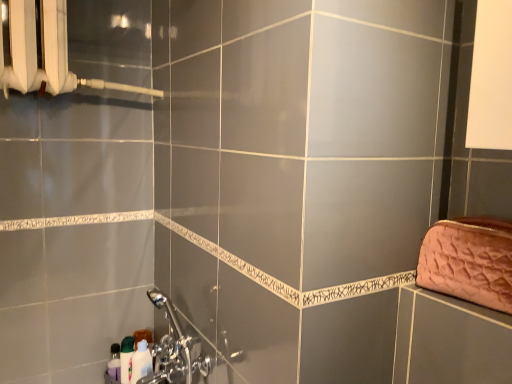
Question: Visually, is green glossy bottle at lower left, acting as the second toiletry starting from the right, positioned to the left or to the right of chrome metallic faucet at lower left?

Choices:
 (A) right
 (B) left

Answer: (B)

Question: From the image's perspective, is green glossy bottle at lower left, the second toiletry in the left-to-right sequence, located above or below chrome metallic faucet at lower left?

Choices:
 (A) below
 (B) above

Answer: (A)

Question: Based on their relative distances, which object is farther from the translucent plastic bottle at lower left, the 1th toiletry in the left-to-right sequence?

Choices:
 (A) green glossy bottle at lower left, acting as the second toiletry starting from the right
 (B) chrome metallic faucet at lower left
 (C) white glossy bottle at lower left, the third toiletry viewed from the left
 (D) pink quilted fabric clutch at right
 (E) white plastic radiator at upper left

Answer: (D)

Question: Considering the real-world distances, which object is farthest from the translucent plastic bottle at lower left, the third toiletry positioned from the right?

Choices:
 (A) pink quilted fabric clutch at right
 (B) white plastic radiator at upper left
 (C) white glossy bottle at lower left, placed as the first toiletry when sorted from right to left
 (D) chrome metallic faucet at lower left
 (E) green glossy bottle at lower left, acting as the second toiletry starting from the right

Answer: (A)